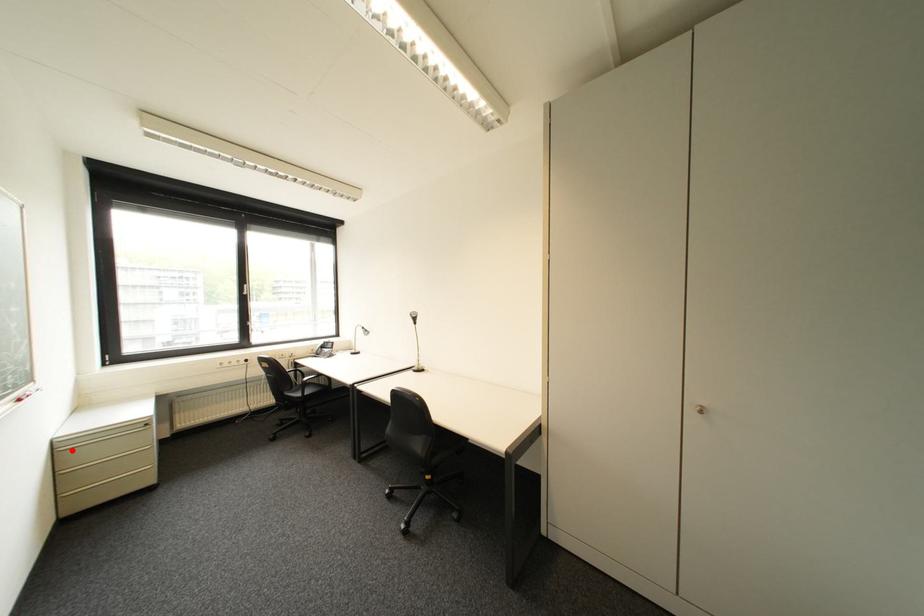
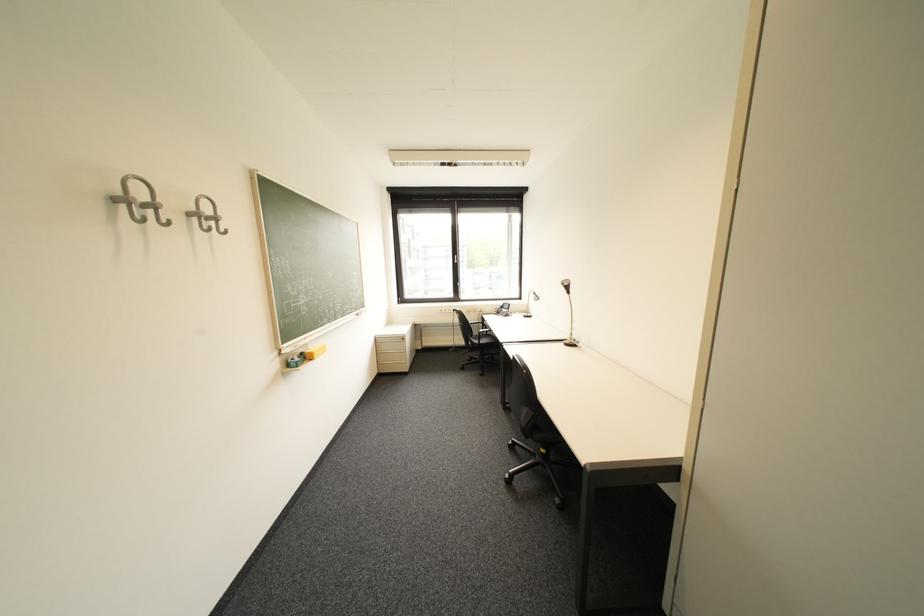
The point at the highlighted location is marked in the first image. Where is the corresponding point in the second image?

(388, 342)